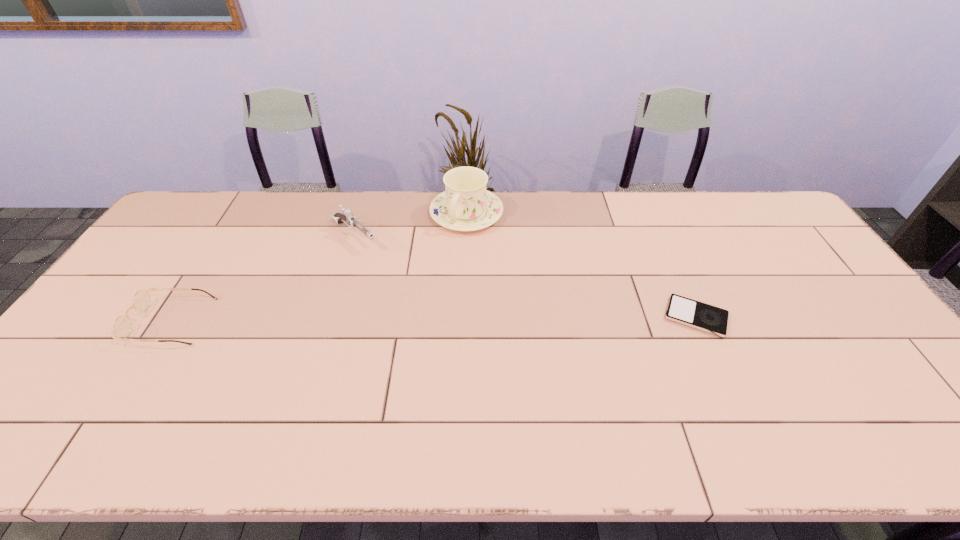
Where is `vacant area that lies between the second object from right to left and the spectacles`? This screenshot has height=540, width=960. vacant area that lies between the second object from right to left and the spectacles is located at coordinates (319, 267).

Identify which object is the third nearest to the spectacles. Please provide its 2D coordinates. Your answer should be formatted as a tuple, i.e. [(x, y)], where the tuple contains the x and y coordinates of a point satisfying the conditions above.

[(682, 310)]

Identify which object is the nearest to the second object from right to left. Please provide its 2D coordinates. Your answer should be formatted as a tuple, i.e. [(x, y)], where the tuple contains the x and y coordinates of a point satisfying the conditions above.

[(347, 217)]